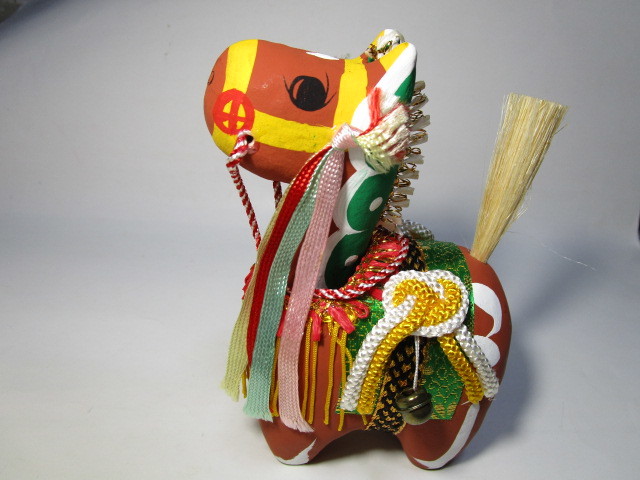
Find the location of `shaded corner`. shaded corner is located at coordinates (3, 8).